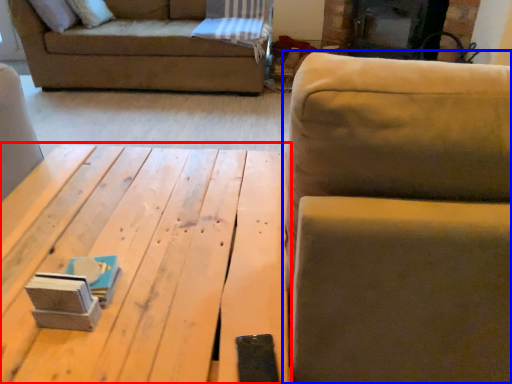
Question: Which point is further to the camera, table (highlighted by a red box) or studio couch (highlighted by a blue box)?

Choices:
 (A) table
 (B) studio couch

Answer: (A)